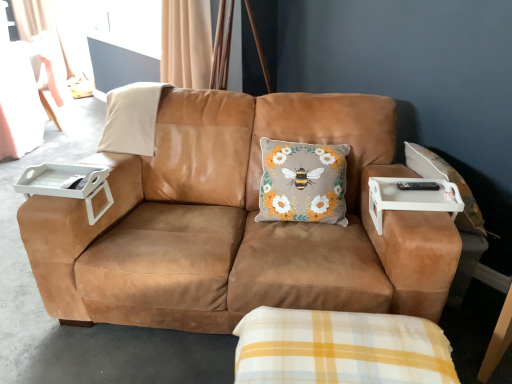
Question: In the image, is white plastic tray at left, placed as the second table when sorted from right to left, on the left side or the right side of beige suede pillow at upper left?

Choices:
 (A) left
 (B) right

Answer: (A)

Question: Is white plastic tray at left, the first table viewed from the left, in front of or behind beige suede pillow at upper left in the image?

Choices:
 (A) behind
 (B) front

Answer: (B)

Question: Estimate the real-world distances between objects in this image. Which object is farther from the white plastic tray at left, placed as the second table when sorted from right to left?

Choices:
 (A) floral-patterned fabric cushion at center
 (B) suede brown couch at center
 (C) beige suede pillow at upper left
 (D) white plastic tray at right, the second table viewed from the left

Answer: (D)

Question: Estimate the real-world distances between objects in this image. Which object is farther from the floral-patterned fabric cushion at center?

Choices:
 (A) white plastic tray at left, the first table viewed from the left
 (B) white plastic tray at right, the 1th table from the right
 (C) suede brown couch at center
 (D) beige suede pillow at upper left

Answer: (A)